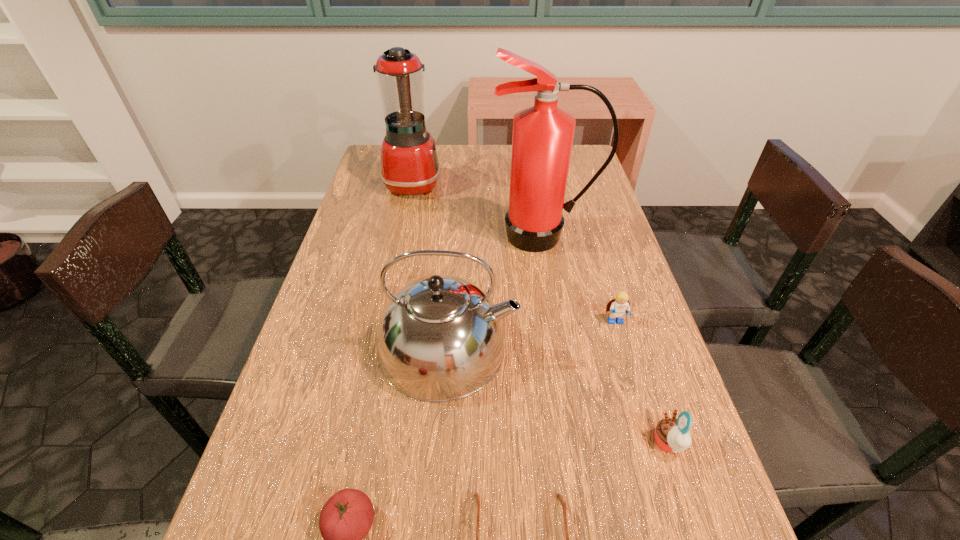
At what (x,y) coordinates should I click in order to perform the action: click on vacant space at the left edge of the desktop. Please return your answer as a coordinate pair (x, y). The width and height of the screenshot is (960, 540). Looking at the image, I should click on (370, 219).

Where is `blank area at the right edge`? The width and height of the screenshot is (960, 540). blank area at the right edge is located at coordinates (564, 252).

Locate an element on the screen. Image resolution: width=960 pixels, height=540 pixels. free point at the far left corner is located at coordinates (363, 174).

This screenshot has height=540, width=960. In the image, there is a desktop. In order to click on vacant area at the far right corner in this screenshot , I will do `click(581, 164)`.

You are a GUI agent. You are given a task and a screenshot of the screen. Output one action in this format:
    pyautogui.click(x=<x>, y=<y>)
    Task: Click on the free space that is in between the food processor and the kettle
    This screenshot has height=540, width=960.
    Given the screenshot: What is the action you would take?
    tap(430, 265)

You are a GUI agent. You are given a task and a screenshot of the screen. Output one action in this format:
    pyautogui.click(x=<x>, y=<y>)
    Task: Click on the free space between the muffin and the fifth shortest object
    The image size is (960, 540).
    Given the screenshot: What is the action you would take?
    pyautogui.click(x=559, y=395)

Find the location of a particular element. free space between the fire extinguisher and the third tallest object is located at coordinates (496, 292).

I want to click on unoccupied area between the farthest object and the third nearest object, so click(x=540, y=313).

You are a GUI agent. You are given a task and a screenshot of the screen. Output one action in this format:
    pyautogui.click(x=<x>, y=<y>)
    Task: Click on the vacant area between the fire extinguisher and the kettle
    The image size is (960, 540).
    Given the screenshot: What is the action you would take?
    pyautogui.click(x=496, y=292)

Find the location of a particular element. vacant area between the Lego and the tallest object is located at coordinates (580, 279).